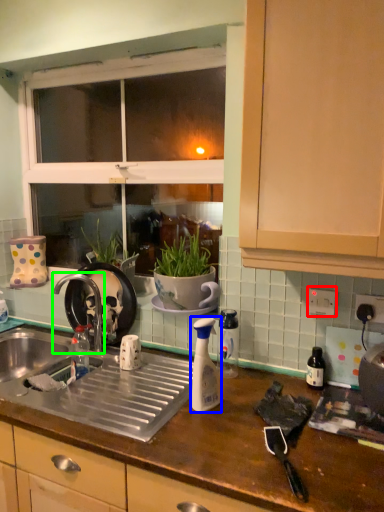
Question: Which object is the closest to the electric outlet (highlighted by a red box)? Choose among these: bottle (highlighted by a blue box) or tap (highlighted by a green box).

Choices:
 (A) bottle
 (B) tap

Answer: (A)